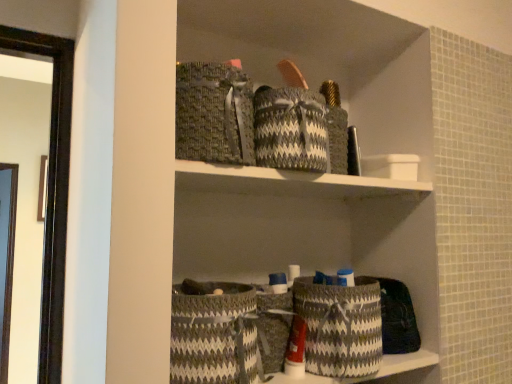
Question: Which direction should I rotate to look at gray woven basket at center, marked as the 2th basket in a left-to-right arrangement, — up or down?

Choices:
 (A) up
 (B) down

Answer: (B)

Question: Is gray woven basket at lower center, the 1th basket in the right-to-left sequence, surrounding gray woven basket at lower center, placed as the first basket when sorted from left to right?

Choices:
 (A) no
 (B) yes

Answer: (A)

Question: Is gray woven basket at lower center, the 1th basket in the right-to-left sequence, placed right next to gray woven basket at lower center, placed as the first basket when sorted from left to right?

Choices:
 (A) no
 (B) yes

Answer: (A)

Question: Is gray woven basket at lower center, the 1th basket in the right-to-left sequence, facing towards gray woven basket at lower center, placed as the first basket when sorted from left to right?

Choices:
 (A) yes
 (B) no

Answer: (B)

Question: Is gray woven basket at lower center, which is the third basket from left to right, positioned with its back to gray woven basket at lower center, which is the 3th basket in right-to-left order?

Choices:
 (A) yes
 (B) no

Answer: (B)

Question: From a real-world perspective, is gray woven basket at lower center, the 1th basket in the right-to-left sequence, located higher than gray woven basket at lower center, placed as the first basket when sorted from left to right?

Choices:
 (A) no
 (B) yes

Answer: (B)

Question: Is the depth of gray woven basket at lower center, which is the third basket from left to right, less than that of gray woven basket at lower center, placed as the first basket when sorted from left to right?

Choices:
 (A) yes
 (B) no

Answer: (B)

Question: Is gray woven basket at center, placed as the 2th basket when sorted from right to left, taller than gray woven basket at lower center, placed as the first basket when sorted from left to right?

Choices:
 (A) yes
 (B) no

Answer: (B)

Question: Is gray woven basket at lower center, which is the 3th basket in right-to-left order, located within gray woven basket at center, marked as the 2th basket in a left-to-right arrangement?

Choices:
 (A) yes
 (B) no

Answer: (B)

Question: Is gray woven basket at lower center, which is the 3th basket in right-to-left order, at the back of gray woven basket at center, marked as the 2th basket in a left-to-right arrangement?

Choices:
 (A) yes
 (B) no

Answer: (B)

Question: From the image's perspective, is gray woven basket at center, marked as the 2th basket in a left-to-right arrangement, below gray woven basket at lower center, which is the 3th basket in right-to-left order?

Choices:
 (A) yes
 (B) no

Answer: (A)

Question: Is gray woven basket at center, placed as the 2th basket when sorted from right to left, at the right side of gray woven basket at lower center, which is the 3th basket in right-to-left order?

Choices:
 (A) no
 (B) yes

Answer: (B)

Question: Is gray woven basket at center, placed as the 2th basket when sorted from right to left, next to gray woven basket at lower center, which is the 3th basket in right-to-left order, and touching it?

Choices:
 (A) no
 (B) yes

Answer: (B)

Question: Is there a large distance between gray woven basket at center, marked as the 2th basket in a left-to-right arrangement, and gray woven basket at lower center, which is the third basket from left to right?

Choices:
 (A) yes
 (B) no

Answer: (B)